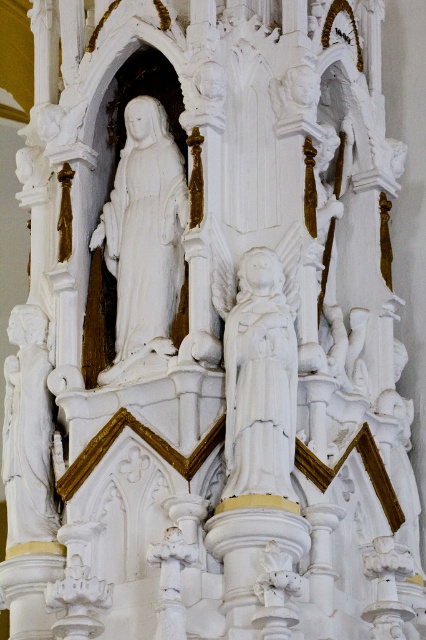
Describe the element at coordinates (144, 236) in the screenshot. I see `white marble statue at upper left` at that location.

Is white marble statue at upper left shorter than white stone statue at left?

No.

This screenshot has width=426, height=640. What do you see at coordinates (144, 236) in the screenshot?
I see `white marble statue at upper left` at bounding box center [144, 236].

Locate an element on the screen. Image resolution: width=426 pixels, height=640 pixels. white marble statue at upper left is located at coordinates (144, 236).

Is white marble statue at upper left to the left of white marble statue at center from the viewer's perspective?

Yes, white marble statue at upper left is to the left of white marble statue at center.

Is point (164, 288) more distant than point (276, 275)?

Yes, it is.

Find the location of a particular element. The image size is (426, 640). white marble statue at upper left is located at coordinates (144, 236).

In the scene shown: Does white marble statue at center have a smaller size compared to white stone statue at left?

Indeed, white marble statue at center has a smaller size compared to white stone statue at left.

The image size is (426, 640). I want to click on white marble statue at center, so click(x=259, y=380).

At what (x,y) coordinates should I click in order to perform the action: click on white marble statue at center. Please return your answer as a coordinate pair (x, y). The width and height of the screenshot is (426, 640). Looking at the image, I should click on (259, 380).